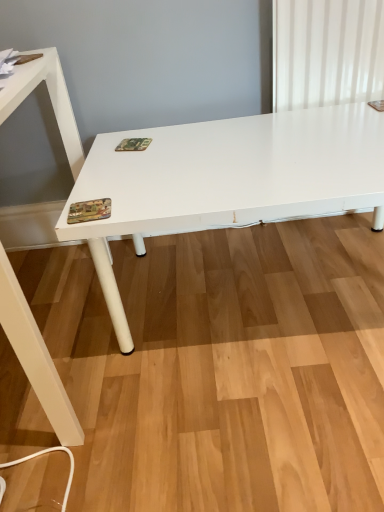
This screenshot has height=512, width=384. Find the location of `vacant area that lies to the right of white matte desk at left`. vacant area that lies to the right of white matte desk at left is located at coordinates (215, 337).